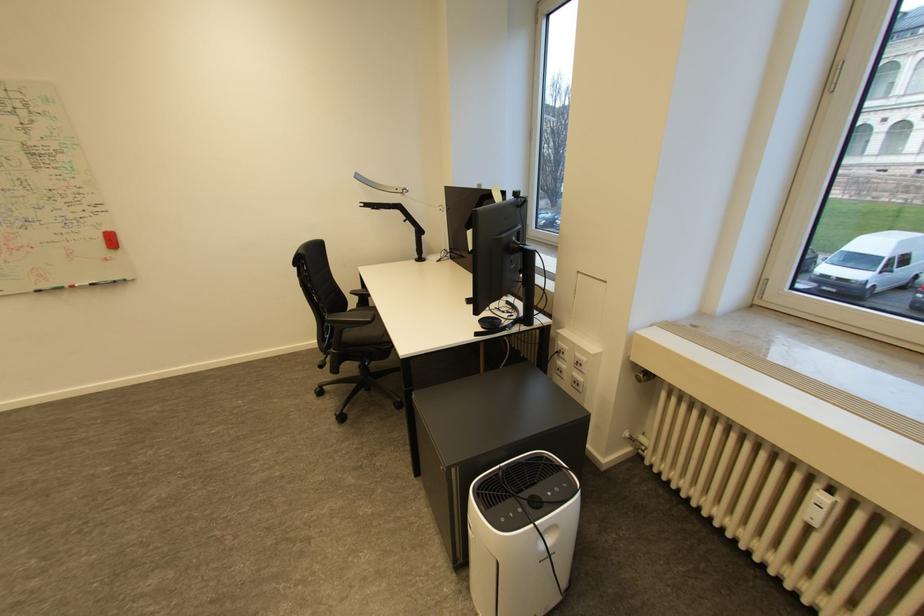
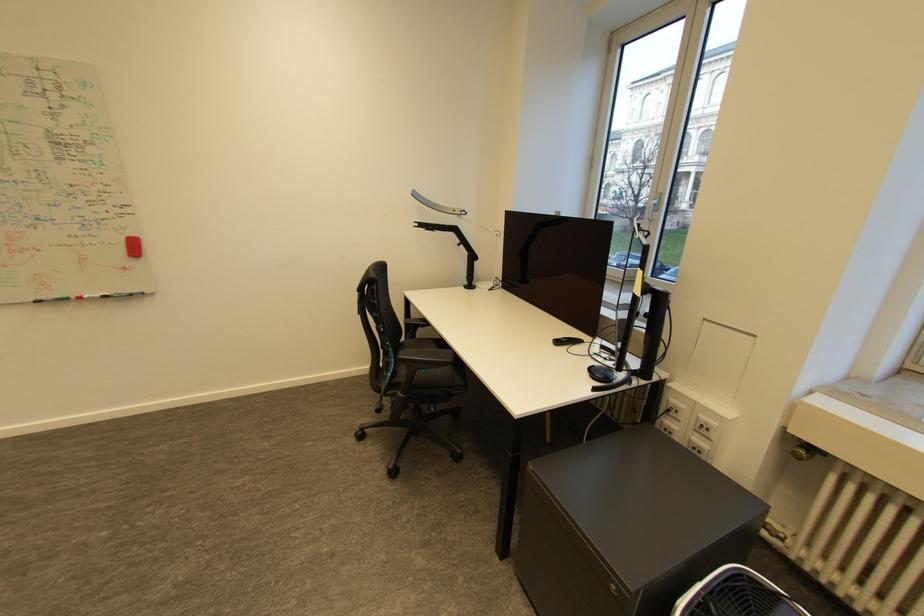
Question: The first image is from the beginning of the video and the second image is from the end. How did the camera likely rotate when shooting the video?

Choices:
 (A) Left
 (B) Right
 (C) Up
 (D) Down

Answer: (C)